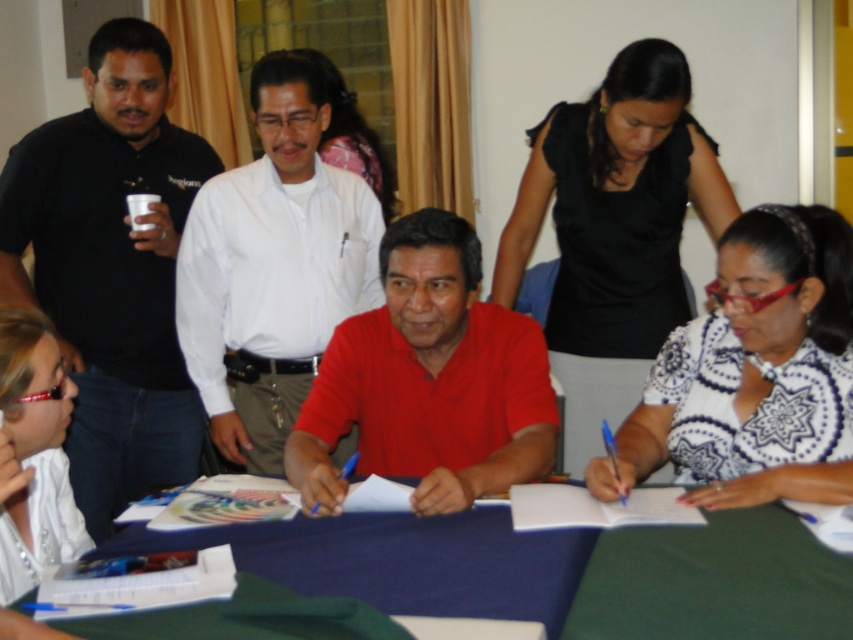
Which of these two, matte red polo shirt at center or white glossy shirt at lower left, stands shorter?

With less height is white glossy shirt at lower left.

Is matte red polo shirt at center wider than white glossy shirt at lower left?

Yes, matte red polo shirt at center is wider than white glossy shirt at lower left.

Is point (402, 332) positioned in front of point (9, 493)?

That is False.

At what (x,y) coordinates should I click in order to perform the action: click on matte red polo shirt at center. Please return your answer as a coordinate pair (x, y). Looking at the image, I should click on (428, 380).

Can you confirm if black matte dress at upper right is positioned to the left of matte red polo shirt at center?

No, black matte dress at upper right is not to the left of matte red polo shirt at center.

Does black matte dress at upper right lie behind matte red polo shirt at center?

Yes, it is behind matte red polo shirt at center.

Which is in front, point (625, 209) or point (328, 476)?

Point (328, 476) is in front.

I want to click on black matte dress at upper right, so click(614, 227).

Between black matte dress at upper right and white glossy shirt at lower left, which one has less height?

With less height is white glossy shirt at lower left.

Is black matte dress at upper right wider than white glossy shirt at lower left?

Yes, black matte dress at upper right is wider than white glossy shirt at lower left.

In order to click on black matte dress at upper right in this screenshot , I will do `click(614, 227)`.